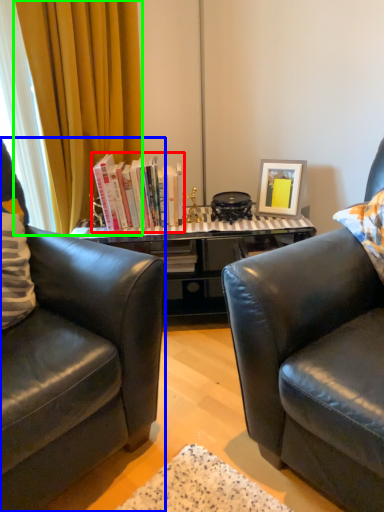
Question: Which object is the closest to the book (highlighted by a red box)? Choose among these: chair (highlighted by a blue box) or curtain (highlighted by a green box).

Choices:
 (A) chair
 (B) curtain

Answer: (B)